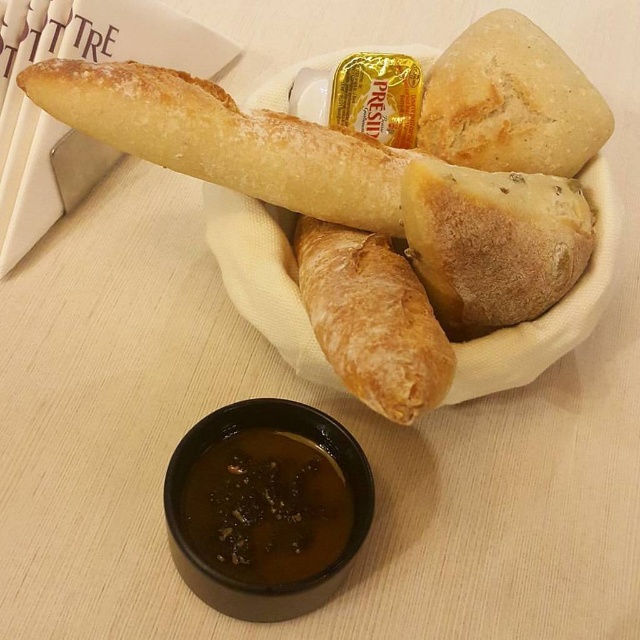
You are a baker who wants to place both the brown crumbly bread at center and the golden brown crusty bread at upper right into a box that can only hold items up to 15 cm in width. Which bread should you choose to ensure it fits?

The golden brown crusty bread at upper right has a smaller width than the brown crumbly bread at center, so it will fit into the box with a 15 cm width limit.

Please provide the coordinates of the brown crumbly bread at center in the image.

The coordinates of the brown crumbly bread at center are at point (492, 243).

Looking at this image, you are a baker who wants to display these two breads on a shelf. The shelf has a height limit of 15 cm. If the golden brown crusty bread at upper right is 10 cm tall, will the brown crumbly bread at center exceed the shelf height limit?

The brown crumbly bread at center is taller than the golden brown crusty bread at upper right. Since the golden brown crusty bread at upper right is 10 cm tall, the brown crumbly bread at center will exceed the 15 cm shelf height limit.